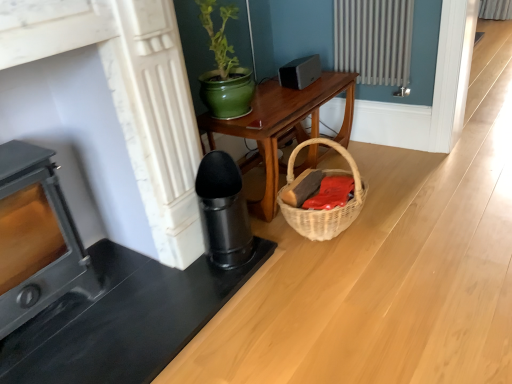
Question: Is woven basket at lower right positioned in front of wooden table at center?

Choices:
 (A) yes
 (B) no

Answer: (A)

Question: Can we say woven basket at lower right lies outside wooden table at center?

Choices:
 (A) yes
 (B) no

Answer: (A)

Question: Does woven basket at lower right have a greater height compared to wooden table at center?

Choices:
 (A) no
 (B) yes

Answer: (A)

Question: Does woven basket at lower right come behind wooden table at center?

Choices:
 (A) no
 (B) yes

Answer: (A)

Question: Is woven basket at lower right positioned with its back to wooden table at center?

Choices:
 (A) no
 (B) yes

Answer: (B)

Question: Based on their positions, is satin black speaker at upper center located to the left or right of woven basket at lower right?

Choices:
 (A) left
 (B) right

Answer: (A)

Question: From a real-world perspective, is satin black speaker at upper center physically located above or below woven basket at lower right?

Choices:
 (A) above
 (B) below

Answer: (A)

Question: Considering the positions of satin black speaker at upper center and woven basket at lower right in the image, is satin black speaker at upper center wider or thinner than woven basket at lower right?

Choices:
 (A) wide
 (B) thin

Answer: (B)

Question: Is point (301, 71) closer or farther from the camera than point (332, 180)?

Choices:
 (A) closer
 (B) farther

Answer: (B)

Question: Considering the positions of woven basket at lower right and metallic gray heater at left in the image, is woven basket at lower right wider or thinner than metallic gray heater at left?

Choices:
 (A) thin
 (B) wide

Answer: (A)

Question: Would you say woven basket at lower right is to the left or to the right of metallic gray heater at left in the picture?

Choices:
 (A) right
 (B) left

Answer: (A)

Question: Looking at the image, does woven basket at lower right seem bigger or smaller compared to metallic gray heater at left?

Choices:
 (A) small
 (B) big

Answer: (A)

Question: From a real-world perspective, relative to metallic gray heater at left, is woven basket at lower right vertically above or below?

Choices:
 (A) above
 (B) below

Answer: (B)

Question: Considering the positions of wooden table at center and metallic gray heater at left in the image, is wooden table at center bigger or smaller than metallic gray heater at left?

Choices:
 (A) big
 (B) small

Answer: (A)

Question: From a real-world perspective, is wooden table at center above or below metallic gray heater at left?

Choices:
 (A) above
 (B) below

Answer: (B)